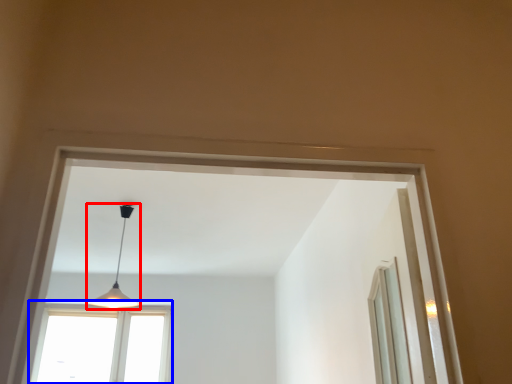
Question: Which of the following is the farthest to the observer, lamp (highlighted by a red box) or window (highlighted by a blue box)?

Choices:
 (A) lamp
 (B) window

Answer: (B)